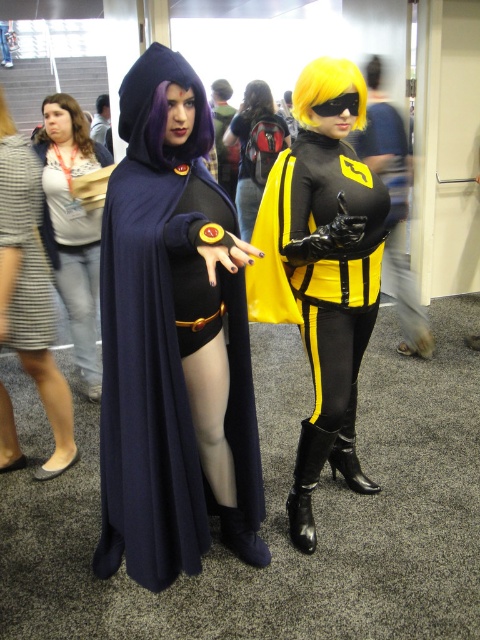
Question: Among these objects, which one is farthest from the camera?

Choices:
 (A) striped fabric dress at lower left
 (B) yellow leather bodysuit at center

Answer: (A)

Question: Does matte gray dress at left have a greater width compared to purple synthetic wig at upper left?

Choices:
 (A) yes
 (B) no

Answer: (A)

Question: Which object is positioned closest to the yellow matte mask at center?

Choices:
 (A) matte gray dress at left
 (B) striped fabric dress at lower left
 (C) matte black backpack at center
 (D) golden synthetic wig at upper right

Answer: (C)

Question: Considering the relative positions of brown hair at upper left and light brown leather jacket at center in the image provided, where is brown hair at upper left located with respect to light brown leather jacket at center?

Choices:
 (A) left
 (B) right

Answer: (B)

Question: Is striped fabric dress at lower left thinner than green fabric jacket at center?

Choices:
 (A) yes
 (B) no

Answer: (A)

Question: Among these points, which one is farthest from the camera?

Choices:
 (A) (380, 74)
 (B) (37, 205)
 (C) (101, 116)
 (D) (296, 188)

Answer: (C)